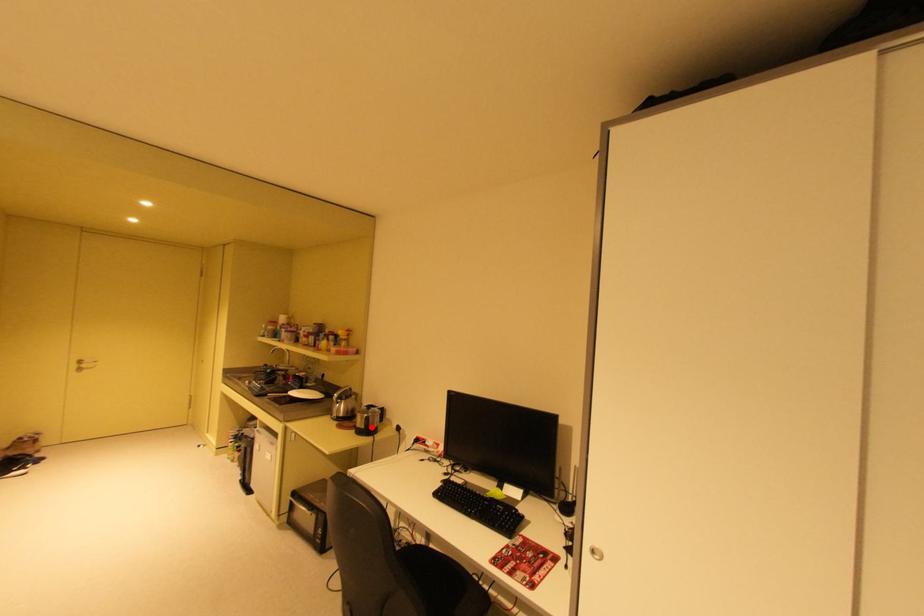
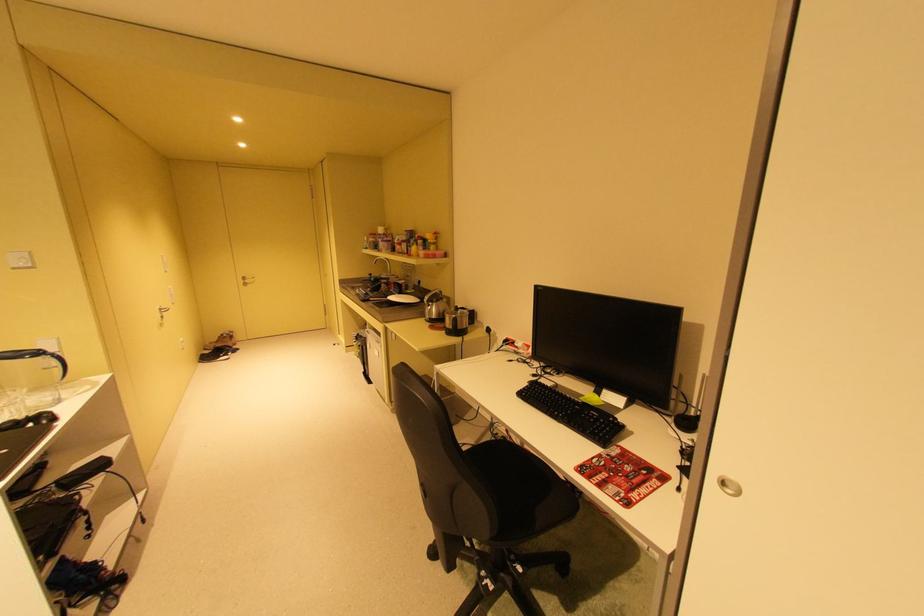
Locate, in the second image, the point that corresponds to the highlighted location in the first image.

(460, 328)